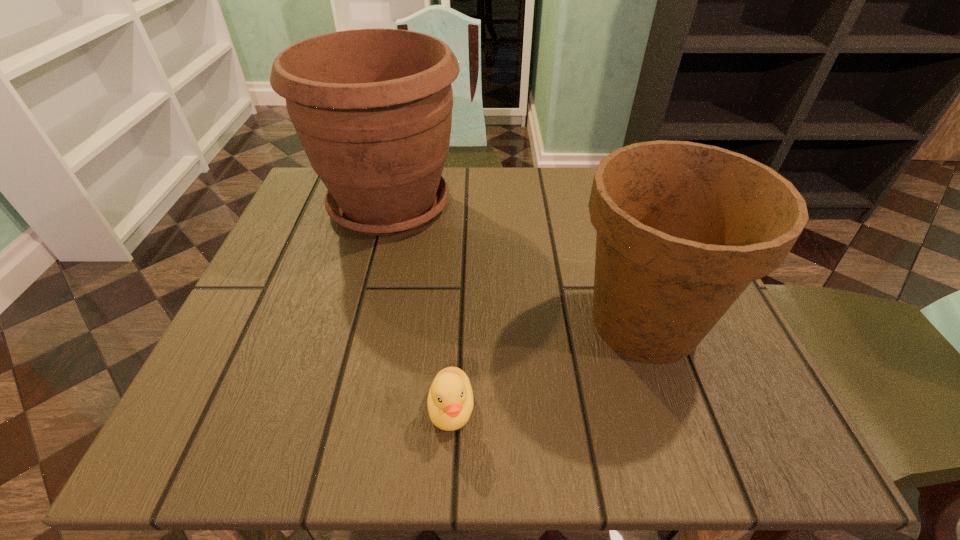
At what (x,y) coordinates should I click in order to perform the action: click on empty location between the duckling and the farther flowerpot. Please return your answer as a coordinate pair (x, y). Looking at the image, I should click on (420, 307).

Where is `vacant point located between the second shortest object and the farthest object`? vacant point located between the second shortest object and the farthest object is located at coordinates (517, 264).

I want to click on vacant region between the farther flowerpot and the shortest object, so click(420, 307).

Locate an element on the screen. The width and height of the screenshot is (960, 540). free spot between the shortest object and the tallest object is located at coordinates (420, 307).

In order to click on free space between the duckling and the rightmost object in this screenshot , I will do `click(548, 366)`.

You are a GUI agent. You are given a task and a screenshot of the screen. Output one action in this format:
    pyautogui.click(x=<x>, y=<y>)
    Task: Click on the free area in between the farthest object and the second tallest object
    Image resolution: width=960 pixels, height=540 pixels.
    Given the screenshot: What is the action you would take?
    pyautogui.click(x=517, y=264)

At what (x,y) coordinates should I click in order to perform the action: click on vacant area between the shortest object and the farthest object. Please return your answer as a coordinate pair (x, y). The width and height of the screenshot is (960, 540). Looking at the image, I should click on 420,307.

Identify which object is located as the second nearest to the farther flowerpot. Please provide its 2D coordinates. Your answer should be formatted as a tuple, i.e. [(x, y)], where the tuple contains the x and y coordinates of a point satisfying the conditions above.

[(450, 402)]

Select which object appears as the closest to the left flowerpot. Please provide its 2D coordinates. Your answer should be formatted as a tuple, i.e. [(x, y)], where the tuple contains the x and y coordinates of a point satisfying the conditions above.

[(683, 228)]